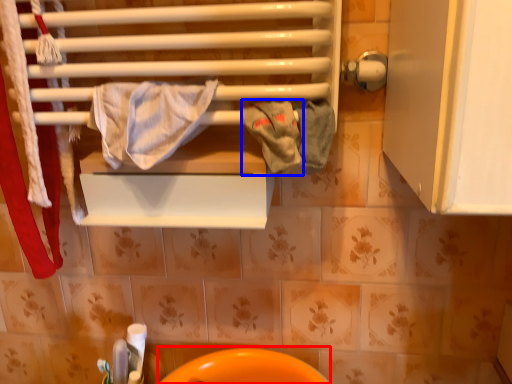
Question: Which object appears closest to the camera in this image, sink (highlighted by a red box) or bath towel (highlighted by a blue box)?

Choices:
 (A) sink
 (B) bath towel

Answer: (B)